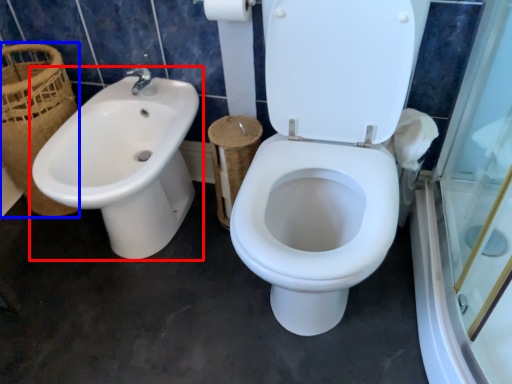
Question: Which object appears farthest to the camera in this image, sink (highlighted by a red box) or basket (highlighted by a blue box)?

Choices:
 (A) sink
 (B) basket

Answer: (B)